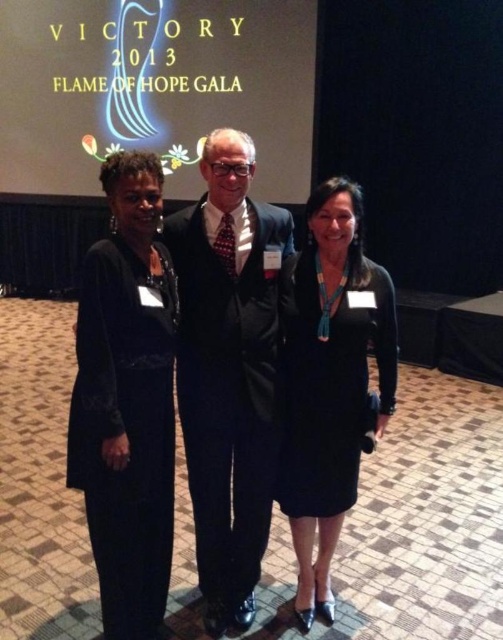
Question: Which object is the farthest from the black textured suit at center?

Choices:
 (A) black satin dress at center
 (B) black satin dress at left

Answer: (B)

Question: Does black textured suit at center appear on the right side of black satin dress at left?

Choices:
 (A) no
 (B) yes

Answer: (B)

Question: Which object is positioned closest to the black satin dress at left?

Choices:
 (A) black textured suit at center
 (B) black satin dress at center

Answer: (A)

Question: Is black satin dress at left above black satin dress at center?

Choices:
 (A) no
 (B) yes

Answer: (B)

Question: Among these objects, which one is farthest from the camera?

Choices:
 (A) black satin dress at left
 (B) black satin dress at center

Answer: (B)

Question: Does black textured suit at center have a larger size compared to black satin dress at left?

Choices:
 (A) yes
 (B) no

Answer: (B)